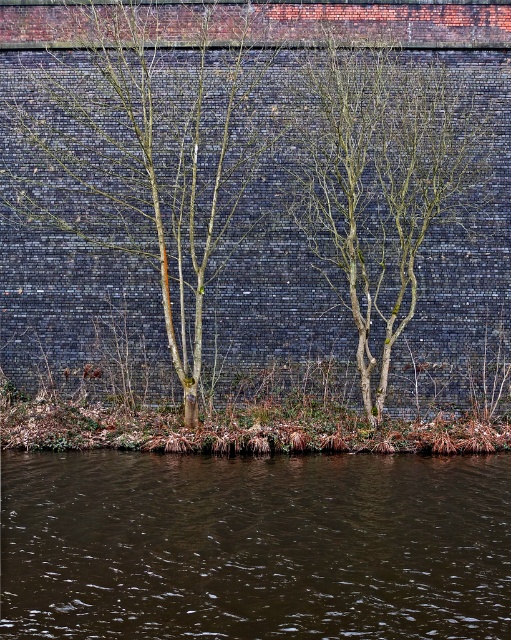
You are an artist trying to sketch the scene from the image. You notice two elements at the center of the image. Which one is closer to you, the bare wood tree at center or the bare branches at center?

The bare wood tree at center is closer to you than the bare branches at center, as it is positioned further to the viewer.

You are standing on the riverside path and want to take a photo of the brown liquid water at lower center and the bare branches at center. Which object should you position to the right side of your camera frame?

You should position the bare branches at center to the right side of your camera frame because the brown liquid water at lower center is to the left of it.

You are standing at the riverside and want to place a small decorative stone at each of the two points marked in the image. Which point, point 1 at coordinates [76,504] or point 2 at coordinates [158,216], is closer to you so that the stone there will be more prominent?

Point 1 at coordinates [76,504] is closer to the viewer than point 2 at coordinates [158,216], so placing the stone there will make it more prominent.